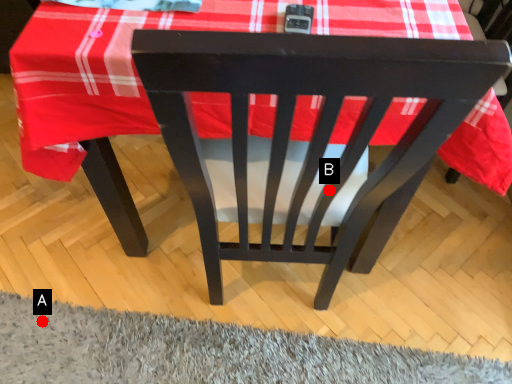
Question: Two points are circled on the image, labeled by A and B beside each circle. Which point appears farthest from the camera in this image?

Choices:
 (A) A is further
 (B) B is further

Answer: (A)